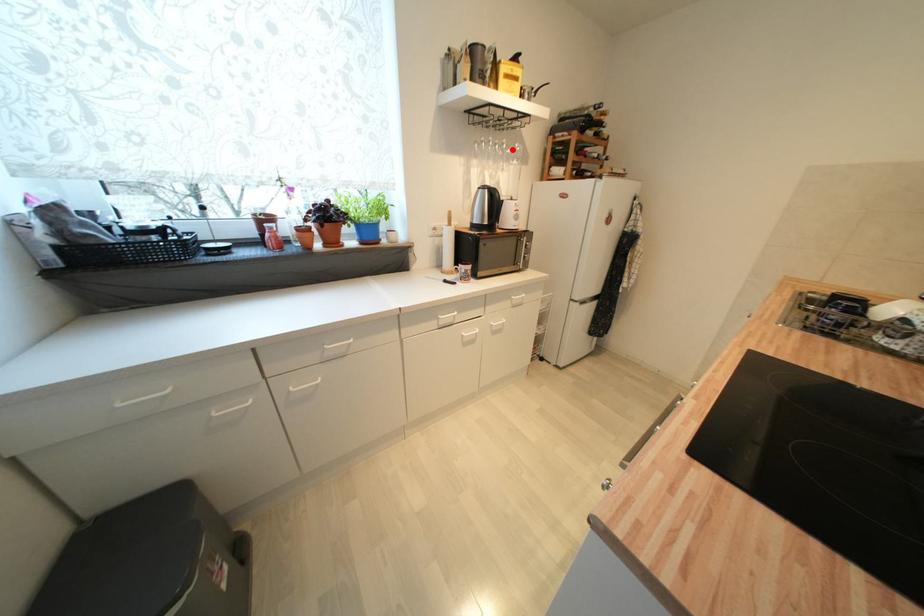
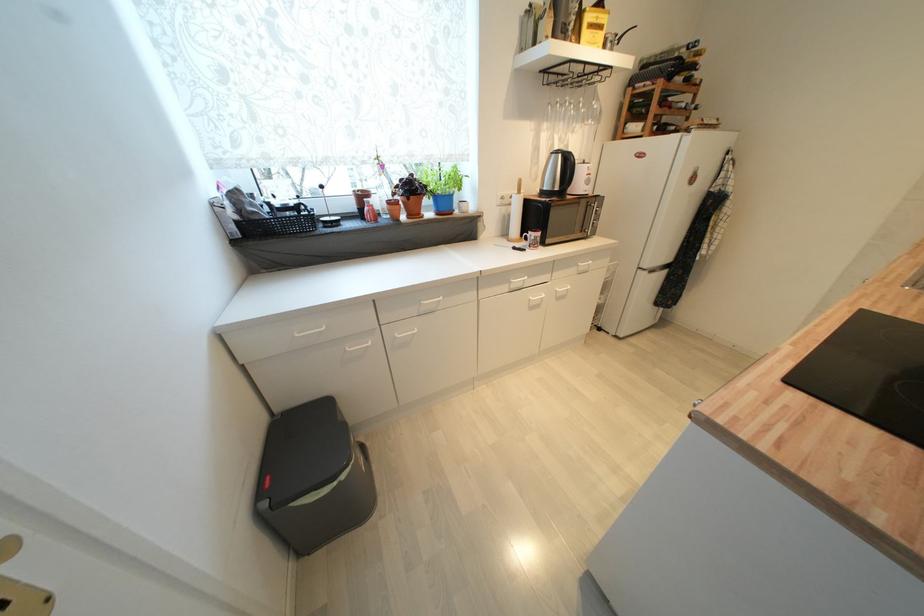
Where in the second image is the point corresponding to the highlighted location from the first image?

(589, 108)